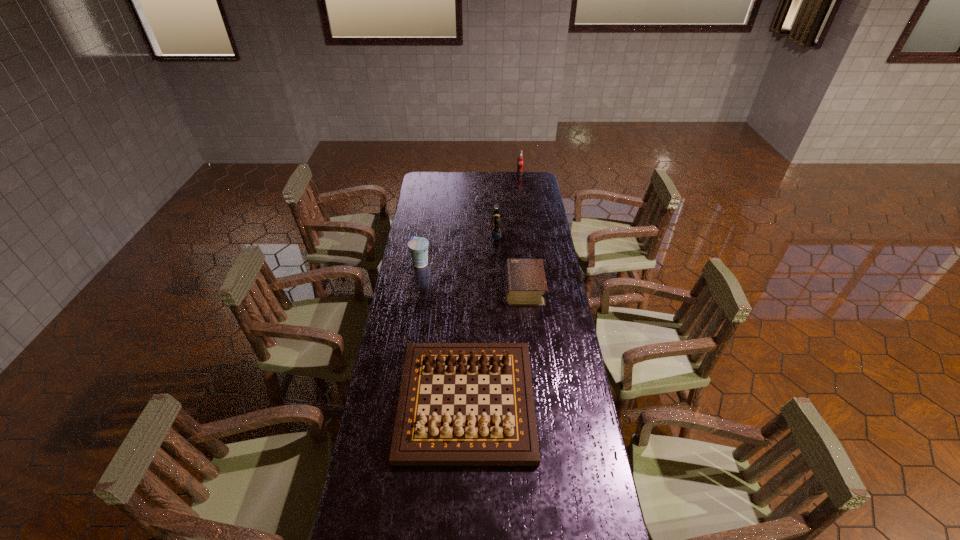
Where is `free space located on the back of the yogurt`? This screenshot has height=540, width=960. free space located on the back of the yogurt is located at coordinates (428, 217).

I want to click on vacant space situated on the side with the white pieces of the nearest object, so [464, 504].

Where is `vacant region located 0.160m on the spine side of the shortest object`? The image size is (960, 540). vacant region located 0.160m on the spine side of the shortest object is located at coordinates (468, 289).

Image resolution: width=960 pixels, height=540 pixels. I want to click on vacant space located on the spine side of the shortest object, so click(462, 289).

I want to click on vacant area located 0.210m on the spine side of the shortest object, so click(x=457, y=289).

Find the location of a particular element. Image resolution: width=960 pixels, height=540 pixels. object at the far edge is located at coordinates pos(520,162).

At what (x,y) coordinates should I click in order to perform the action: click on yogurt positioned at the left edge. Please return your answer as a coordinate pair (x, y). Image resolution: width=960 pixels, height=540 pixels. Looking at the image, I should click on (418, 246).

The width and height of the screenshot is (960, 540). I want to click on gameboard that is positioned at the left edge, so [421, 438].

This screenshot has height=540, width=960. I want to click on soda bottle present at the right edge, so click(x=520, y=162).

At what (x,y) coordinates should I click in order to perform the action: click on Bible that is at the right edge. Please return your answer as a coordinate pair (x, y). The image size is (960, 540). Looking at the image, I should click on pos(525,280).